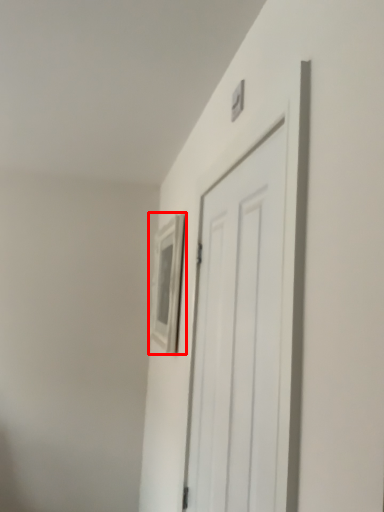
Question: In this image, where is picture frame (annotated by the red box) located relative to door?

Choices:
 (A) right
 (B) left

Answer: (B)